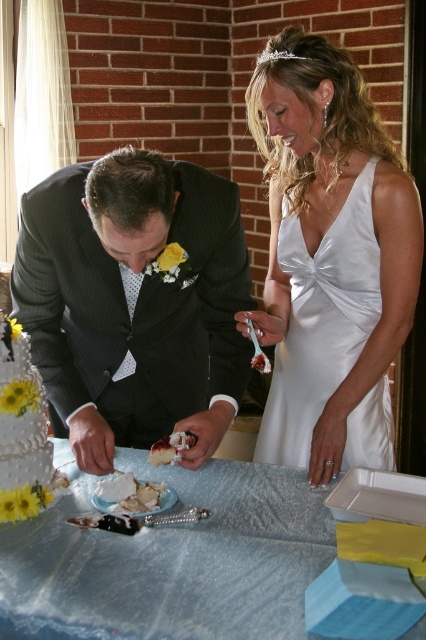
Is satin white dress at center wider than white satin cocktail dress at center?

Indeed, satin white dress at center has a greater width compared to white satin cocktail dress at center.

Between satin white dress at center and white satin cocktail dress at center, which one appears on the right side from the viewer's perspective?

white satin cocktail dress at center

Where is `satin white dress at center`? satin white dress at center is located at coordinates (325, 234).

Does white satin cocktail dress at center have a lesser width compared to white cake at center?

In fact, white satin cocktail dress at center might be wider than white cake at center.

Which is behind, point (368, 259) or point (158, 449)?

Point (368, 259)

What are the coordinates of `white satin cocktail dress at center` in the screenshot? It's located at (321, 321).

Can you confirm if shiny silver table at center is positioned to the right of white satin cocktail dress at center?

No, shiny silver table at center is not to the right of white satin cocktail dress at center.

Describe the element at coordinates (172, 561) in the screenshot. I see `shiny silver table at center` at that location.

At what (x,y) coordinates should I click in order to perform the action: click on shiny silver table at center. Please return your answer as a coordinate pair (x, y). The width and height of the screenshot is (426, 640). Looking at the image, I should click on (172, 561).